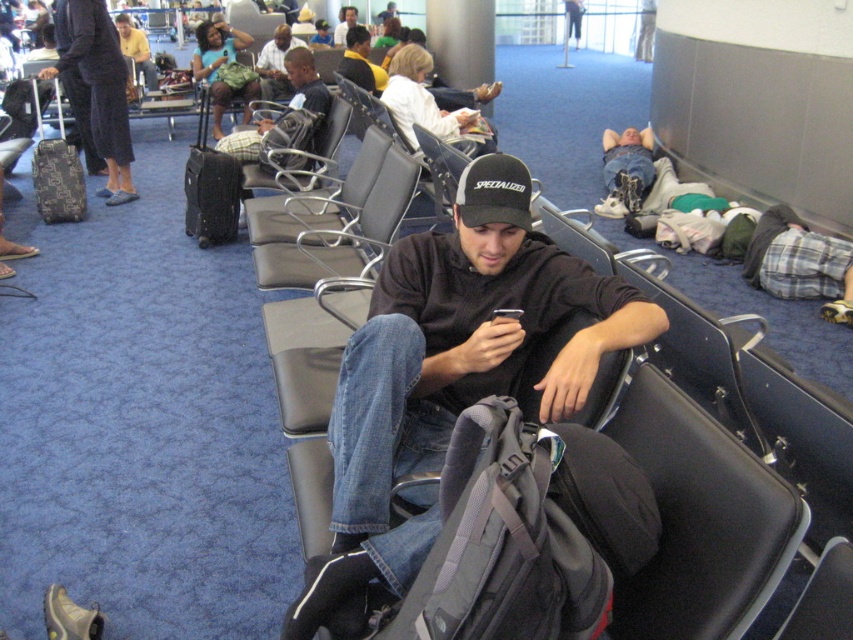
Does point (241, 188) come closer to viewer compared to point (646, 156)?

That is True.

Who is positioned more to the left, black textured suitcase at center or denim jeans at center?

black textured suitcase at center

Between point (190, 163) and point (633, 195), which one is positioned behind?

Positioned behind is point (633, 195).

Locate an element on the screen. black textured suitcase at center is located at coordinates (210, 188).

Does point (94, 99) lie in front of point (36, 86)?

Yes.

Does point (102, 42) come farther from viewer compared to point (62, 160)?

Yes, it is.

Is point (109, 134) farther from camera compared to point (73, 220)?

Yes, point (109, 134) is farther from viewer.

At what (x,y) coordinates should I click in order to perform the action: click on matte black suitcase at left. Please return your answer as a coordinate pair (x, y). This screenshot has height=640, width=853. Looking at the image, I should click on (97, 86).

Does dark gray hoodie at center have a greater height compared to matte black suitcase at left?

Incorrect, dark gray hoodie at center's height is not larger of matte black suitcase at left's.

Can you confirm if dark gray hoodie at center is positioned to the left of matte black suitcase at left?

Incorrect, dark gray hoodie at center is not on the left side of matte black suitcase at left.

Identify the location of dark gray hoodie at center. The height and width of the screenshot is (640, 853). (447, 378).